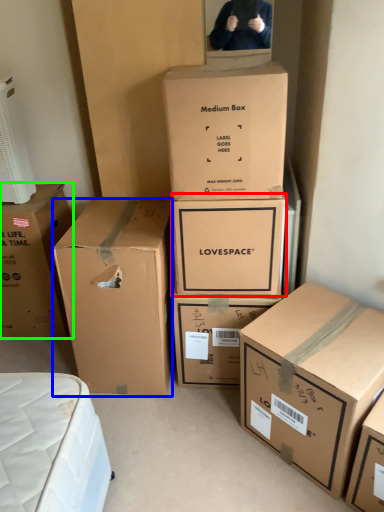
Question: Which is nearer to the box (highlighted by a red box)? box (highlighted by a blue box) or box (highlighted by a green box).

Choices:
 (A) box
 (B) box

Answer: (A)